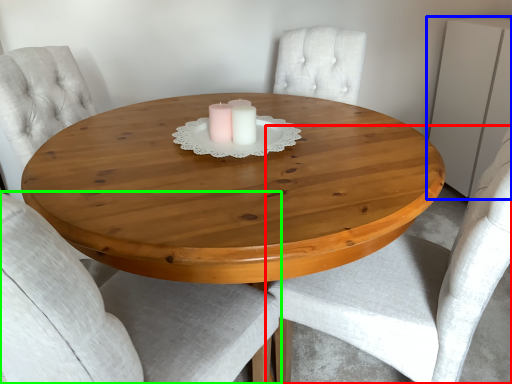
Question: Which is farther away from chair (highlighted by a red box)? dresser (highlighted by a blue box) or chair (highlighted by a green box)?

Choices:
 (A) dresser
 (B) chair

Answer: (A)